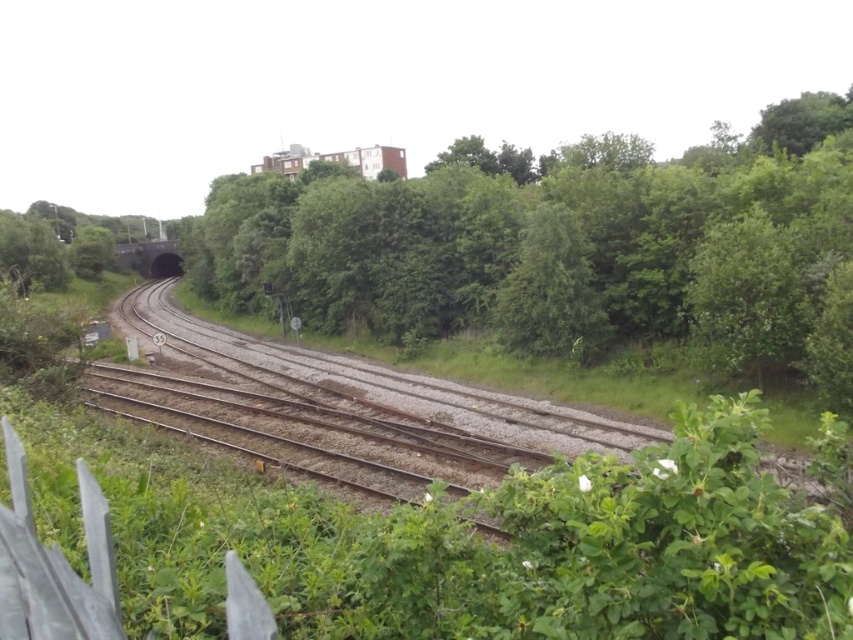
Consider the image. You are standing at the point labeled as point (569, 250) in the railway scene. What object is exactly at that location?

The green leafy tree at center is located at point (569, 250).